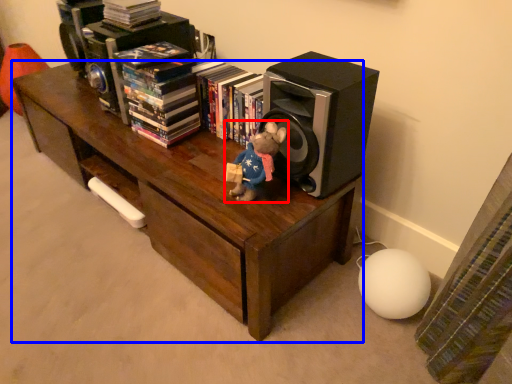
Question: Which object appears closest to the camera in this image, toy (highlighted by a red box) or table (highlighted by a blue box)?

Choices:
 (A) toy
 (B) table

Answer: (A)